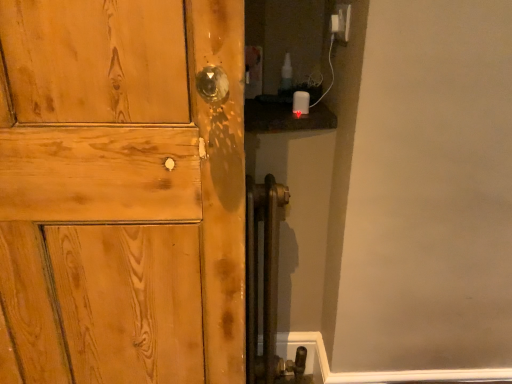
Question: In the image, is matte wood door at center positioned in front of or behind white plastic electric outlet at upper right?

Choices:
 (A) front
 (B) behind

Answer: (A)

Question: From their relative heights in the image, would you say matte wood door at center is taller or shorter than white plastic electric outlet at upper right?

Choices:
 (A) short
 (B) tall

Answer: (B)

Question: Would you say matte wood door at center is inside or outside white plastic electric outlet at upper right?

Choices:
 (A) outside
 (B) inside

Answer: (A)

Question: Relative to matte wood door at center, is white plastic electric outlet at upper right in front or behind?

Choices:
 (A) front
 (B) behind

Answer: (B)

Question: Considering the positions of white plastic electric outlet at upper right and matte wood door at center in the image, is white plastic electric outlet at upper right wider or thinner than matte wood door at center?

Choices:
 (A) wide
 (B) thin

Answer: (B)

Question: Would you say white plastic electric outlet at upper right is inside or outside matte wood door at center?

Choices:
 (A) outside
 (B) inside

Answer: (A)

Question: From a real-world perspective, relative to matte wood door at center, is white plastic electric outlet at upper right vertically above or below?

Choices:
 (A) above
 (B) below

Answer: (A)